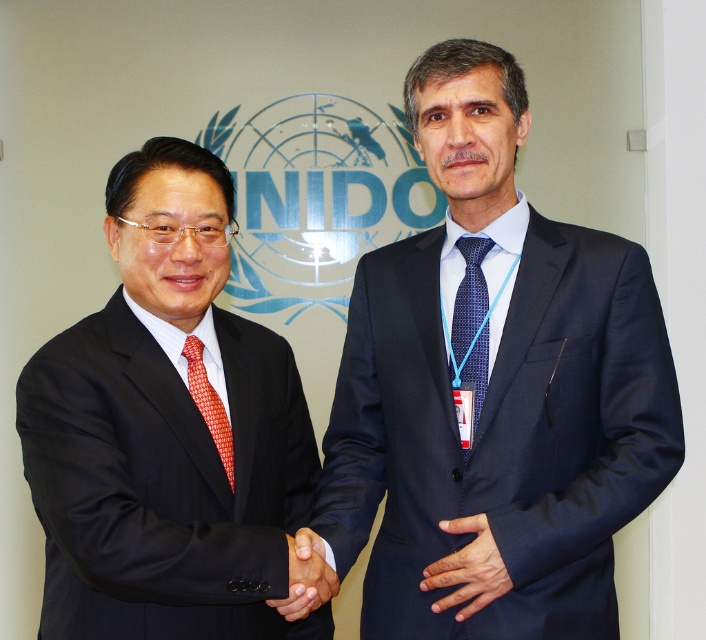
You are organizing a formal event and need to ensure that the dark blue suit at center and the red woven tie at center are displayed properly. Based on their sizes, which one should be placed on a wider display stand?

The dark blue suit at center might be wider than the red woven tie at center, so it should be placed on a wider display stand.

Looking at this image, you are an event organizer and need to ensure proper seating arrangements. Based on the image, which of the two suits, the dark blue suit at center or the matte black suit at left, would require a larger chair to accommodate its wearer?

The dark blue suit at center requires a larger chair because it is larger in size than the matte black suit at left.